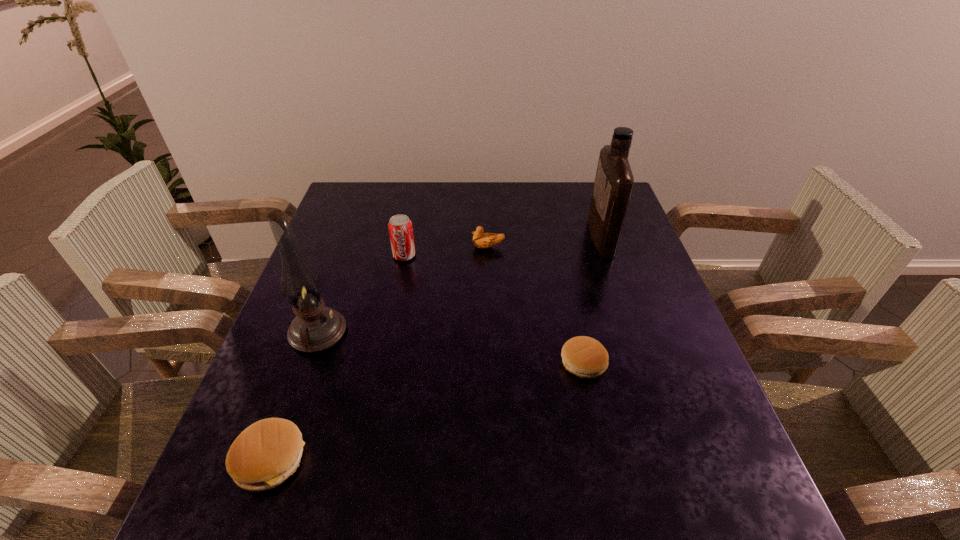
Locate an element on the screen. The width and height of the screenshot is (960, 540). vacant space that satisfies the following two spatial constraints: 1. on the face of the fourth object from left to right; 2. on the logo side of the fourth shortest object is located at coordinates (489, 255).

Find the location of a particular element. vacant region that satisfies the following two spatial constraints: 1. on the label side of the liquor; 2. on the front side of the shorter patty is located at coordinates (643, 363).